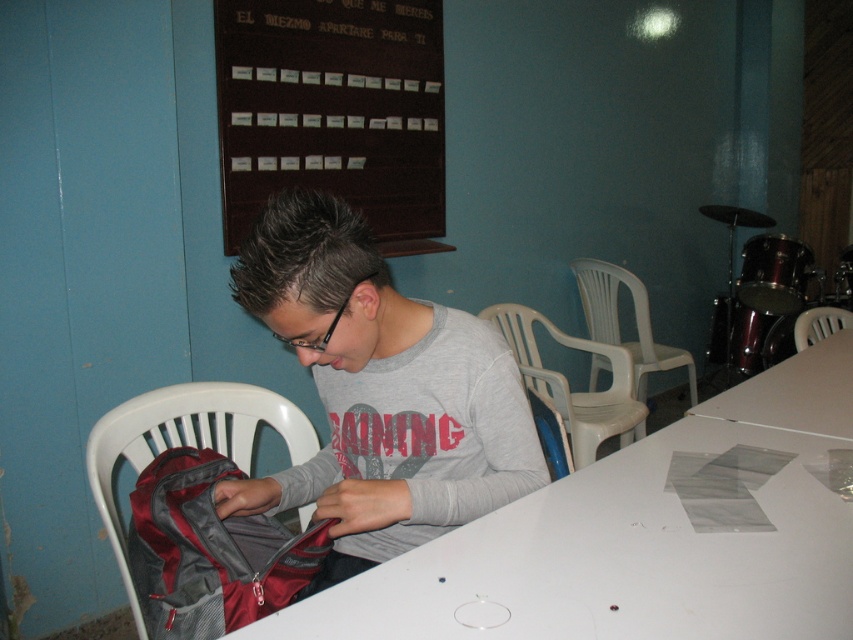
Does point (424, 106) come closer to viewer compared to point (805, 406)?

No, it is behind (805, 406).

Can you confirm if wooden plaque at upper center is positioned to the right of white matte table at lower right?

Incorrect, wooden plaque at upper center is not on the right side of white matte table at lower right.

Does point (389, 152) lie in front of point (845, 355)?

No.

Where is `wooden plaque at upper center`? wooden plaque at upper center is located at coordinates (334, 112).

Who is taller, wooden plaque at upper center or white plastic chair at center?

Standing taller between the two is wooden plaque at upper center.

Which is in front, point (233, 90) or point (592, 444)?

Point (233, 90) is in front.

I want to click on wooden plaque at upper center, so click(x=334, y=112).

Does white matte table at center have a greater width compared to white matte table at lower right?

Correct, the width of white matte table at center exceeds that of white matte table at lower right.

Which is behind, point (567, 538) or point (746, 419)?

The point (746, 419) is more distant.

The width and height of the screenshot is (853, 640). What do you see at coordinates (637, 540) in the screenshot?
I see `white matte table at center` at bounding box center [637, 540].

Locate an element on the screen. This screenshot has height=640, width=853. white matte table at center is located at coordinates (637, 540).